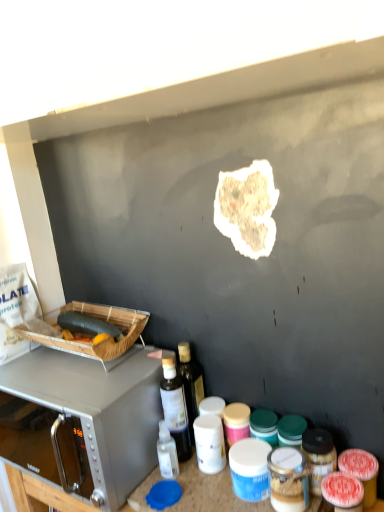
Question: Is satin silver microwave at upper left at the left side of matte plastic container at center, which is the 1th appliance from bottom to top?

Choices:
 (A) no
 (B) yes

Answer: (B)

Question: Is matte plastic container at center, the first appliance positioned from the front, at the back of satin silver microwave at upper left?

Choices:
 (A) yes
 (B) no

Answer: (B)

Question: Is satin silver microwave at upper left taller than matte plastic container at center, the second appliance in the back-to-front sequence?

Choices:
 (A) yes
 (B) no

Answer: (A)

Question: Considering the relative sizes of satin silver microwave at upper left and matte plastic container at center, which is the second appliance from top to bottom, in the image provided, is satin silver microwave at upper left wider than matte plastic container at center, which is the second appliance from top to bottom,?

Choices:
 (A) yes
 (B) no

Answer: (A)

Question: Considering the relative sizes of satin silver microwave at upper left and matte plastic container at center, the second appliance in the back-to-front sequence, in the image provided, is satin silver microwave at upper left smaller than matte plastic container at center, the second appliance in the back-to-front sequence,?

Choices:
 (A) no
 (B) yes

Answer: (A)

Question: In terms of width, does brown crumbly bread at center, the first food viewed from the front, look wider or thinner when compared to translucent plastic bottle at center?

Choices:
 (A) thin
 (B) wide

Answer: (A)

Question: Considering their positions, is brown crumbly bread at center, the 2th food in the bottom-to-top sequence, located in front of or behind translucent plastic bottle at center?

Choices:
 (A) front
 (B) behind

Answer: (A)

Question: Considering the positions of brown crumbly bread at center, the 2th food in the bottom-to-top sequence, and translucent plastic bottle at center in the image, is brown crumbly bread at center, the 2th food in the bottom-to-top sequence, taller or shorter than translucent plastic bottle at center?

Choices:
 (A) tall
 (B) short

Answer: (B)

Question: From a real-world perspective, is brown crumbly bread at center, acting as the 1th food starting from the right, above or below translucent plastic bottle at center?

Choices:
 (A) above
 (B) below

Answer: (A)

Question: Is point (306, 486) positioned closer to the camera than point (130, 475)?

Choices:
 (A) farther
 (B) closer

Answer: (B)

Question: Would you say matte plastic container at center, the 1th appliance from the right, is to the left or to the right of satin silver microwave at upper left in the picture?

Choices:
 (A) right
 (B) left

Answer: (A)

Question: From a real-world perspective, relative to satin silver microwave at upper left, is matte plastic container at center, the 1th appliance from the right, vertically above or below?

Choices:
 (A) above
 (B) below

Answer: (B)

Question: Considering the positions of matte plastic container at center, the second appliance in the back-to-front sequence, and satin silver microwave at upper left in the image, is matte plastic container at center, the second appliance in the back-to-front sequence, taller or shorter than satin silver microwave at upper left?

Choices:
 (A) short
 (B) tall

Answer: (A)

Question: Considering the positions of point (271, 462) and point (67, 318), is point (271, 462) closer or farther from the camera than point (67, 318)?

Choices:
 (A) farther
 (B) closer

Answer: (B)

Question: From a real-world perspective, is matte plastic container at center, which is the second appliance from top to bottom, positioned above or below green matte zucchini at left, which is the second food from right to left?

Choices:
 (A) above
 (B) below

Answer: (B)